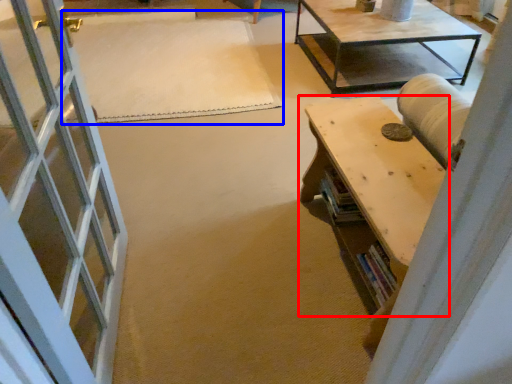
Question: Which object is further to the camera taking this photo, table (highlighted by a red box) or mat (highlighted by a blue box)?

Choices:
 (A) table
 (B) mat

Answer: (B)